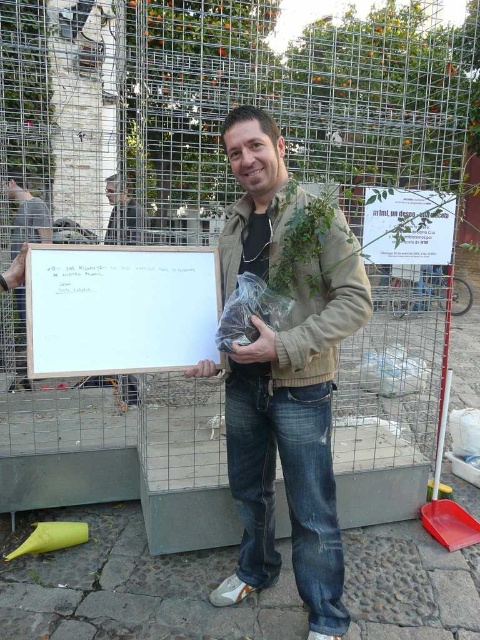
Question: Is white matte board at center below matte black jacket at center?

Choices:
 (A) no
 (B) yes

Answer: (B)

Question: Which object is the closest to the white matte board at center?

Choices:
 (A) matte white board at center
 (B) brown leather jacket at center
 (C) matte black jacket at center

Answer: (B)

Question: Does brown leather jacket at center appear over matte white board at center?

Choices:
 (A) yes
 (B) no

Answer: (B)

Question: Among these points, which one is farthest from the camera?

Choices:
 (A) click(17, 328)
 (B) click(91, 374)
 (C) click(110, 216)

Answer: (C)

Question: Which of the following is the closest to the observer?

Choices:
 (A) (287, 346)
 (B) (194, 296)
 (C) (25, 380)
 (D) (122, 204)

Answer: (A)

Question: Is matte white board at center behind matte black jacket at center?

Choices:
 (A) no
 (B) yes

Answer: (B)